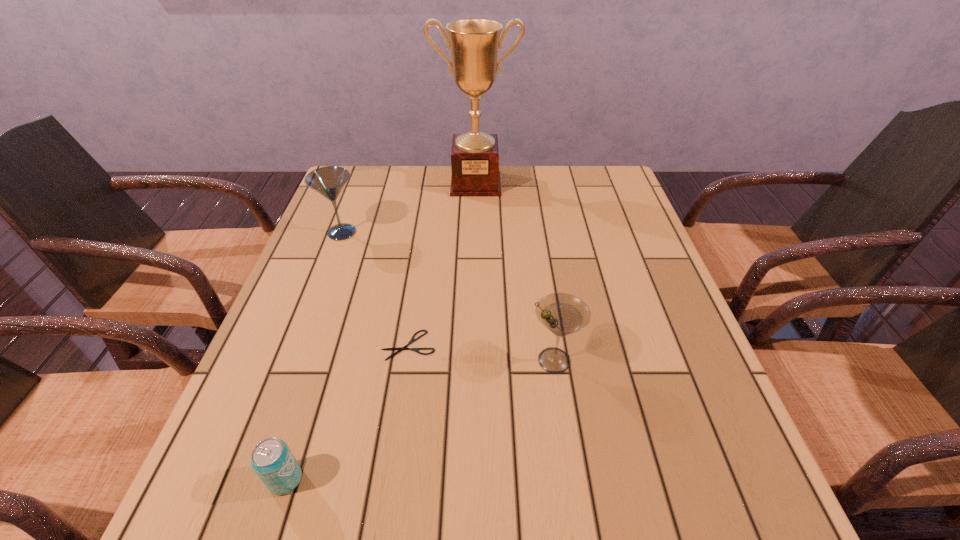
You are a GUI agent. You are given a task and a screenshot of the screen. Output one action in this format:
    pyautogui.click(x=<x>, y=<y>)
    Task: Click on the trophy cup
    Image resolution: width=960 pixels, height=540 pixels.
    Given the screenshot: What is the action you would take?
    click(474, 43)

The height and width of the screenshot is (540, 960). In order to click on the tallest object in this screenshot , I will do `click(474, 43)`.

The width and height of the screenshot is (960, 540). Find the location of `the left martini`. the left martini is located at coordinates (329, 181).

Where is `the farther martini`? This screenshot has width=960, height=540. the farther martini is located at coordinates (329, 181).

Identify the location of the nearer martini. (562, 314).

Image resolution: width=960 pixels, height=540 pixels. What are the coordinates of `the fourth tallest object` in the screenshot? It's located at (272, 460).

You are a GUI agent. You are given a task and a screenshot of the screen. Output one action in this format:
    pyautogui.click(x=<x>, y=<y>)
    Task: Click on the beer can
    
    Given the screenshot: What is the action you would take?
    pyautogui.click(x=272, y=460)

Locate an element on the screen. This screenshot has height=540, width=960. shears is located at coordinates (412, 340).

Where is `vacant space located 0.130m on the plaque of the farthest object`? Image resolution: width=960 pixels, height=540 pixels. vacant space located 0.130m on the plaque of the farthest object is located at coordinates (475, 221).

You are a GUI agent. You are given a task and a screenshot of the screen. Output one action in this format:
    pyautogui.click(x=<x>, y=<y>)
    Task: Click on the vacant space situated 0.280m on the back of the farther martini
    The image size is (960, 540).
    Given the screenshot: What is the action you would take?
    pyautogui.click(x=365, y=171)